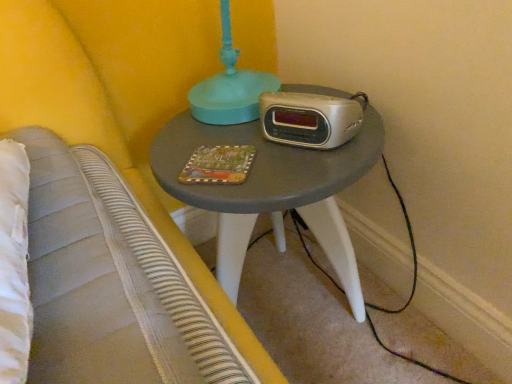
Identify the location of vacant position to the left of silver metallic clock radio at center. (225, 138).